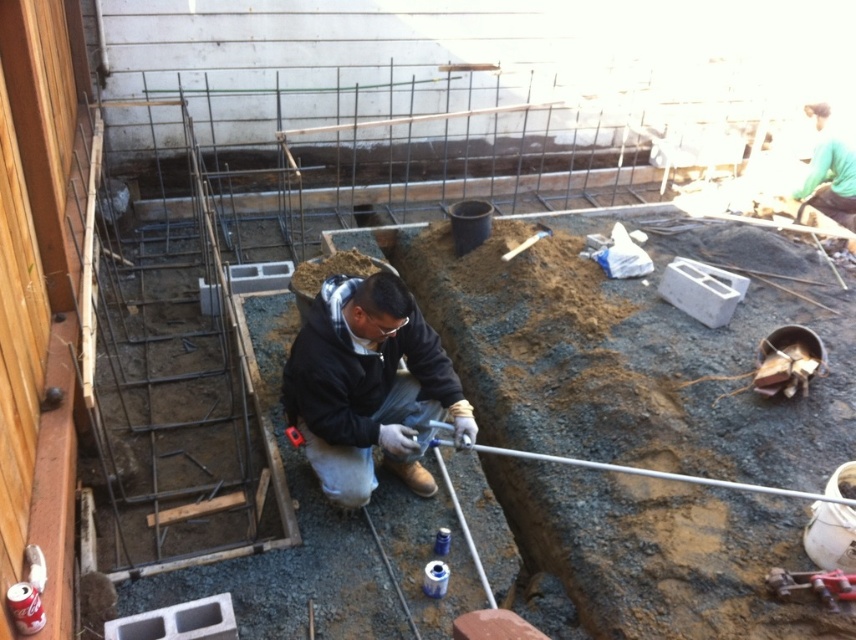
Question: Does black matte jacket at center come in front of smooth concrete hole at center?

Choices:
 (A) no
 (B) yes

Answer: (A)

Question: Can you confirm if black matte jacket at center is thinner than smooth concrete hole at center?

Choices:
 (A) yes
 (B) no

Answer: (B)

Question: Which of the following is the closest to the observer?

Choices:
 (A) (822, 147)
 (B) (288, 406)
 (C) (201, 611)

Answer: (C)

Question: Which is nearer to the green fabric shirt at upper right?

Choices:
 (A) black matte jacket at center
 (B) smooth concrete hole at center
 (C) metallic red drill at lower right

Answer: (C)

Question: Can you confirm if black matte jacket at center is positioned to the right of green fabric shirt at upper right?

Choices:
 (A) no
 (B) yes

Answer: (A)

Question: Which point is closer to the camera?

Choices:
 (A) (191, 609)
 (B) (406, 484)

Answer: (A)